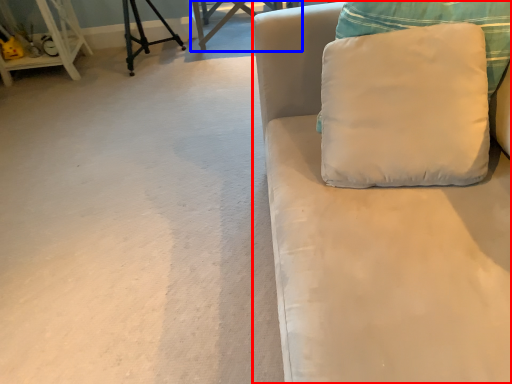
Question: Which point is closer to the camera, studio couch (highlighted by a red box) or table (highlighted by a blue box)?

Choices:
 (A) studio couch
 (B) table

Answer: (A)